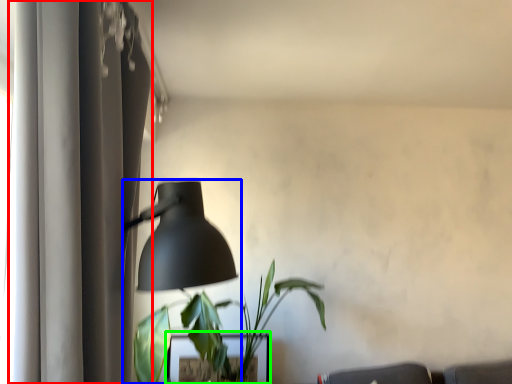
Question: Considering the real-world distances, which object is farthest from curtain (highlighted by a red box)? lamp (highlighted by a blue box) or table (highlighted by a green box)?

Choices:
 (A) lamp
 (B) table

Answer: (B)